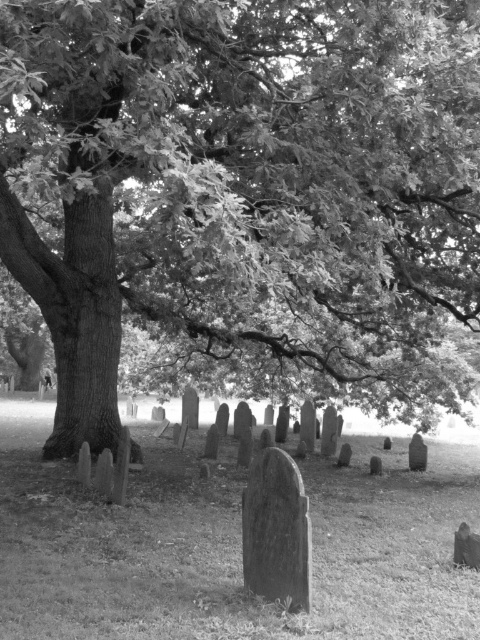
Question: Which of the following is the farthest from the observer?

Choices:
 (A) (243, 540)
 (B) (61, 88)

Answer: (B)

Question: Which point appears farthest from the camera in this image?

Choices:
 (A) (299, 557)
 (B) (356, 330)

Answer: (B)

Question: Considering the relative positions of smooth bark tree at center and smooth stone gravestone at center in the image provided, where is smooth bark tree at center located with respect to smooth stone gravestone at center?

Choices:
 (A) right
 (B) left

Answer: (B)

Question: Is smooth bark tree at center positioned in front of smooth stone gravestone at center?

Choices:
 (A) yes
 (B) no

Answer: (A)

Question: Is smooth bark tree at center to the left of smooth stone gravestone at center from the viewer's perspective?

Choices:
 (A) yes
 (B) no

Answer: (A)